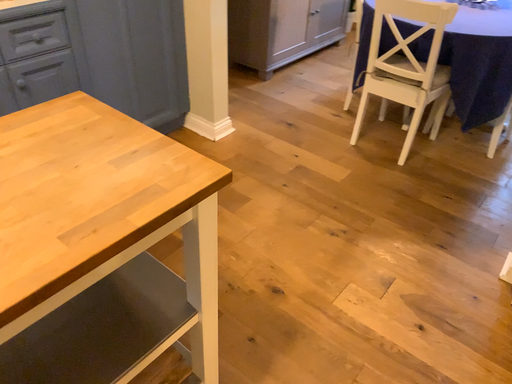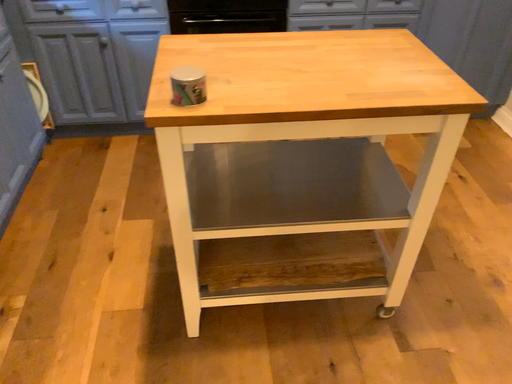
Question: Which way did the camera rotate in the video?

Choices:
 (A) rotated upward
 (B) rotated downward

Answer: (A)